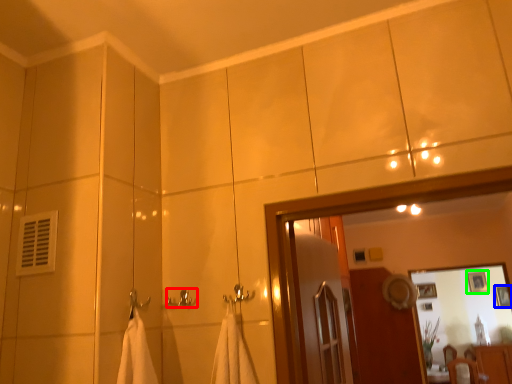
Question: Estimate the real-world distances between objects in this image. Which object is farther from towel bar (highlighted by a red box), picture frame (highlighted by a blue box) or picture frame (highlighted by a green box)?

Choices:
 (A) picture frame
 (B) picture frame

Answer: (A)